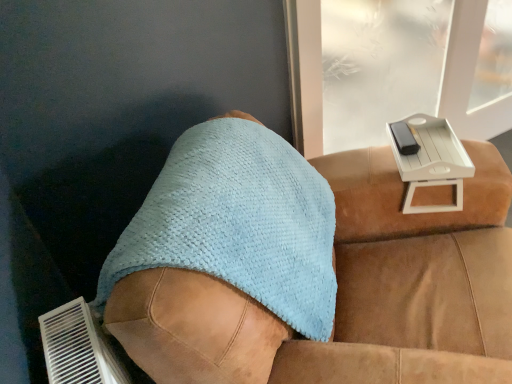
Question: Considering the relative sizes of light brown leather couch at center and light blue textured towel at center in the image provided, is light brown leather couch at center smaller than light blue textured towel at center?

Choices:
 (A) yes
 (B) no

Answer: (B)

Question: Would you say light blue textured towel at center is part of light brown leather couch at center's contents?

Choices:
 (A) no
 (B) yes

Answer: (B)

Question: Is light brown leather couch at center to the right of light blue textured towel at center from the viewer's perspective?

Choices:
 (A) yes
 (B) no

Answer: (A)

Question: Is light brown leather couch at center at the left side of light blue textured towel at center?

Choices:
 (A) yes
 (B) no

Answer: (B)

Question: Is light brown leather couch at center taller than light blue textured towel at center?

Choices:
 (A) no
 (B) yes

Answer: (B)

Question: Does light brown leather couch at center have a lesser height compared to light blue textured towel at center?

Choices:
 (A) yes
 (B) no

Answer: (B)

Question: From the image's perspective, is light brown leather couch at center on white plastic tray at upper right?

Choices:
 (A) yes
 (B) no

Answer: (B)

Question: Does light brown leather couch at center touch white plastic tray at upper right?

Choices:
 (A) yes
 (B) no

Answer: (B)

Question: Is light brown leather couch at center to the right of white plastic tray at upper right from the viewer's perspective?

Choices:
 (A) no
 (B) yes

Answer: (A)

Question: Is light brown leather couch at center to the left of white plastic tray at upper right from the viewer's perspective?

Choices:
 (A) yes
 (B) no

Answer: (A)

Question: From a real-world perspective, is light brown leather couch at center located higher than white plastic tray at upper right?

Choices:
 (A) yes
 (B) no

Answer: (B)

Question: Is light brown leather couch at center located outside white plastic tray at upper right?

Choices:
 (A) no
 (B) yes

Answer: (B)

Question: Is light blue textured towel at center further to camera compared to light brown leather couch at center?

Choices:
 (A) yes
 (B) no

Answer: (A)